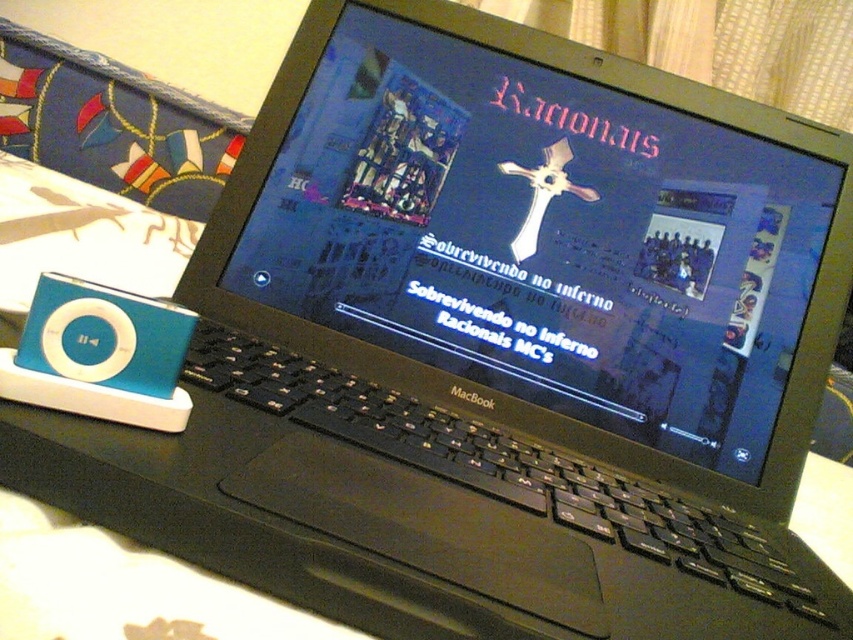
You are organizing a music event and need to set up two devices. You have a black matte laptop at center and a teal matte ipod at left. From the perspective of someone facing the setup, which device is closer to the front?

The black matte laptop at center is closer to the front because the teal matte ipod at left is positioned behind it.

You are setting up a small home studio and need to place your black matte laptop at center and teal matte ipod at left. The minimum required distance between them for optimal audio recording is 30 centimeters. Based on the scene, will the current placement meet this requirement?

The distance between the black matte laptop at center and the teal matte ipod at left is 30.03 centimeters, which is just over the required 30 centimeters. Therefore, the current placement meets the requirement for optimal audio recording.